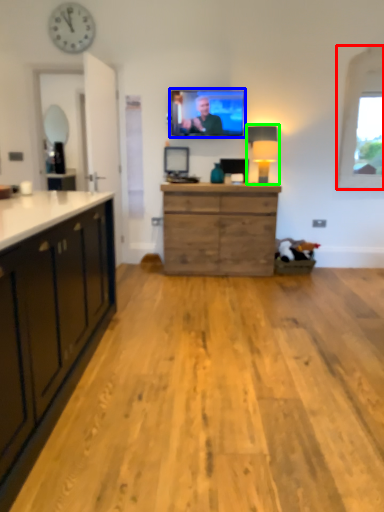
Question: Based on their relative distances, which object is nearer to window (highlighted by a red box)? Choose from television (highlighted by a blue box) and lamp (highlighted by a green box).

Choices:
 (A) television
 (B) lamp

Answer: (B)